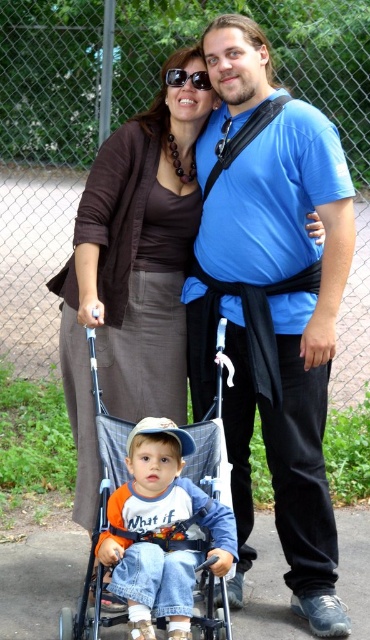
Looking at this image, who is taller, blue cotton shirt at center or sunglasses at center?

With more height is blue cotton shirt at center.

Can you confirm if blue cotton shirt at center is thinner than sunglasses at center?

Incorrect, blue cotton shirt at center's width is not less than sunglasses at center's.

Does point (301, 476) come behind point (183, 81)?

No, (301, 476) is closer to viewer.

The image size is (370, 640). I want to click on blue cotton shirt at center, so click(273, 307).

Between blue fabric stroller at center and sunglasses at center, which one appears on the right side from the viewer's perspective?

From the viewer's perspective, sunglasses at center appears more on the right side.

Looking at this image, who is shorter, blue fabric stroller at center or sunglasses at center?

sunglasses at center

From the picture: Who is more forward, (216, 422) or (179, 68)?

Positioned in front is point (216, 422).

Locate an element on the screen. The height and width of the screenshot is (640, 370). blue fabric stroller at center is located at coordinates [99, 515].

Does point (244, 212) come in front of point (227, 497)?

No, (244, 212) is further to viewer.

Does blue cotton shirt at center appear on the left side of blue fabric stroller at center?

No, blue cotton shirt at center is not to the left of blue fabric stroller at center.

Locate an element on the screen. This screenshot has height=640, width=370. blue cotton shirt at center is located at coordinates (273, 307).

I want to click on blue cotton shirt at center, so click(x=273, y=307).